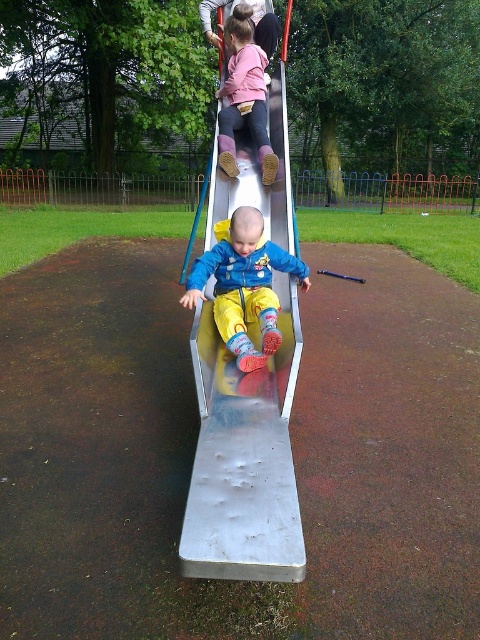
Does blue fleece jacket at center lie behind matte pink sweater at upper center?

No, blue fleece jacket at center is in front of matte pink sweater at upper center.

Between blue fleece jacket at center and matte pink sweater at upper center, which one has less height?

Standing shorter between the two is blue fleece jacket at center.

Does point (190, 291) come farther from viewer compared to point (257, 54)?

No, (190, 291) is closer to viewer.

Find the location of `blue fleece jacket at center`. blue fleece jacket at center is located at coordinates (243, 285).

Does metallic smooth slide at center have a greater width compared to blue fleece jacket at center?

No, metallic smooth slide at center is not wider than blue fleece jacket at center.

Locate an element on the screen. The image size is (480, 640). metallic smooth slide at center is located at coordinates [243, 456].

Is point (280, 413) farther from viewer compared to point (194, 266)?

No, (280, 413) is in front of (194, 266).

Identify the location of metallic smooth slide at center. (243, 456).

Is metallic smooth slide at center to the left of matte pink sweater at upper center from the viewer's perspective?

Incorrect, metallic smooth slide at center is not on the left side of matte pink sweater at upper center.

Is point (229, 577) in front of point (229, 128)?

Yes, point (229, 577) is closer to viewer.

Locate an element on the screen. This screenshot has width=480, height=640. metallic smooth slide at center is located at coordinates (243, 456).